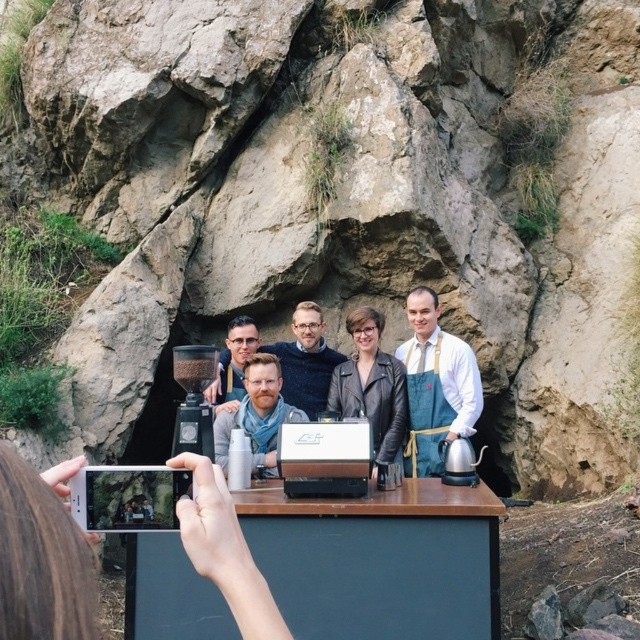
Question: Which of the following is the closest to the observer?

Choices:
 (A) (13, 540)
 (B) (419, 445)
 (C) (323, 323)

Answer: (A)

Question: Which point is farther to the camera?

Choices:
 (A) (252, 342)
 (B) (317, 353)

Answer: (B)

Question: Is blue apron at center positioned in front of dark blue sweater at center?

Choices:
 (A) yes
 (B) no

Answer: (A)

Question: From the image, what is the correct spatial relationship of blue apron at center in relation to dark blue sweater at center?

Choices:
 (A) above
 (B) below

Answer: (B)

Question: Can you confirm if white matte phone at lower left is thinner than matte black shirt at center?

Choices:
 (A) no
 (B) yes

Answer: (A)

Question: Which object is farther from the camera taking this photo?

Choices:
 (A) white matte phone at lower left
 (B) matte black shirt at center

Answer: (B)